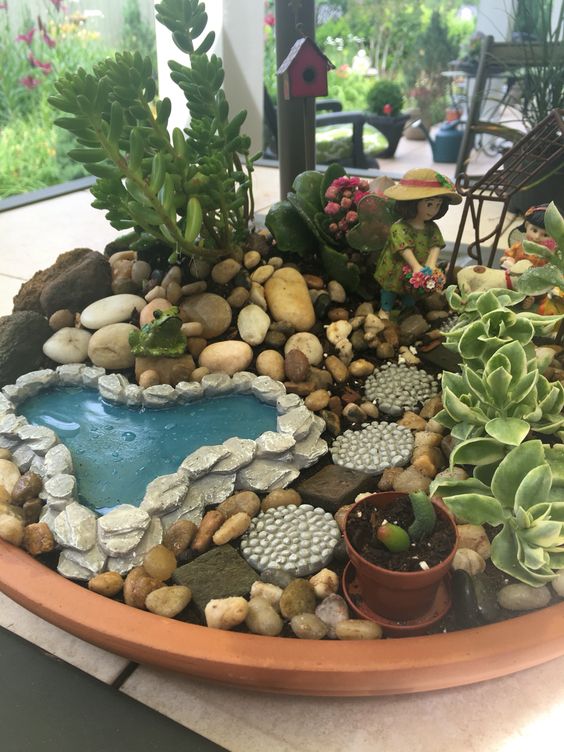
I want to click on small cacti, so point(428,511), point(396,538).